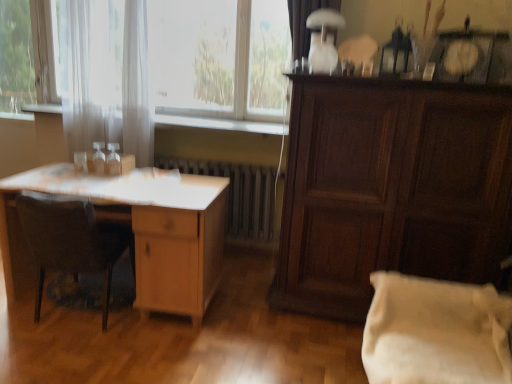
Identify the location of vacant area that is in front of wooden chair at left. (47, 353).